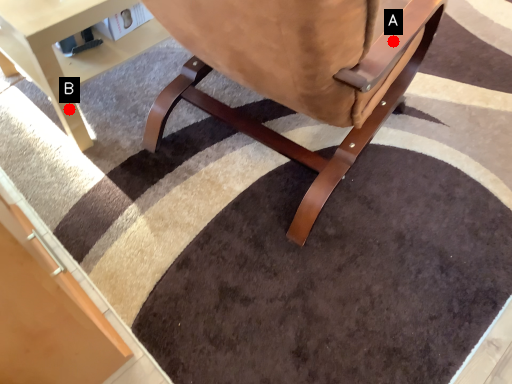
Question: Two points are circled on the image, labeled by A and B beside each circle. Which point is further to the camera?

Choices:
 (A) A is further
 (B) B is further

Answer: (B)